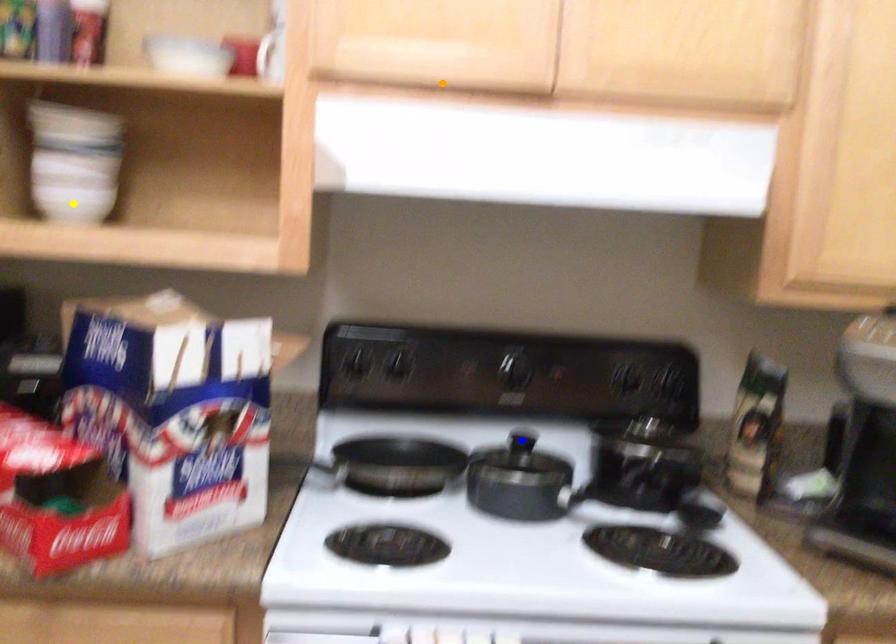
Order these from nearest to farthest:
- orange point
- yellow point
- blue point

orange point
yellow point
blue point